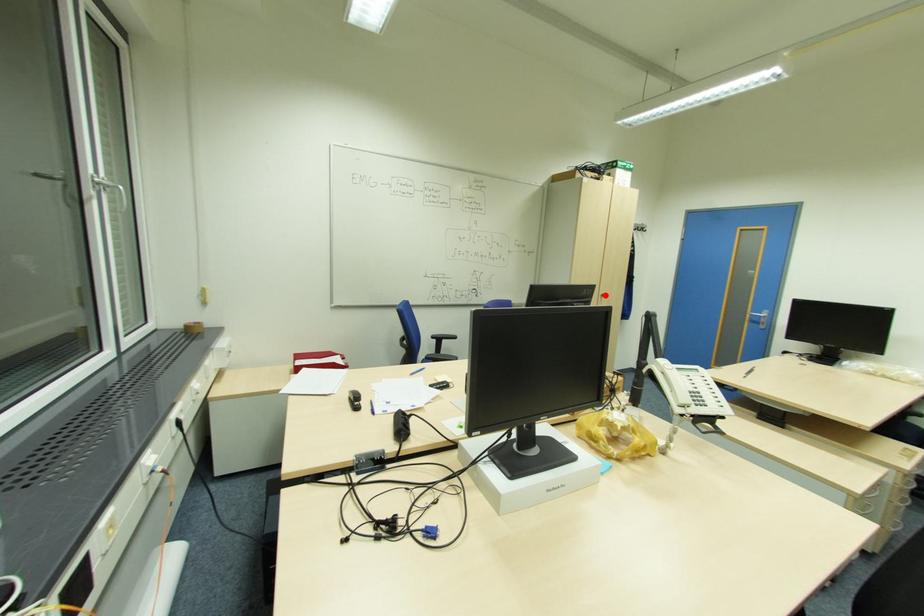
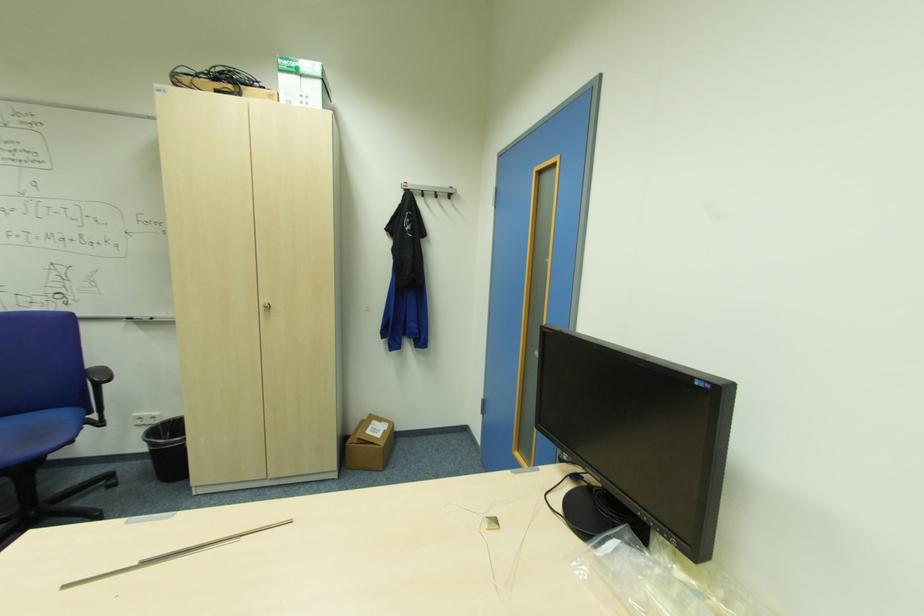
Where in the second image is the point corresponding to the highlighted location from the first image?

(271, 307)